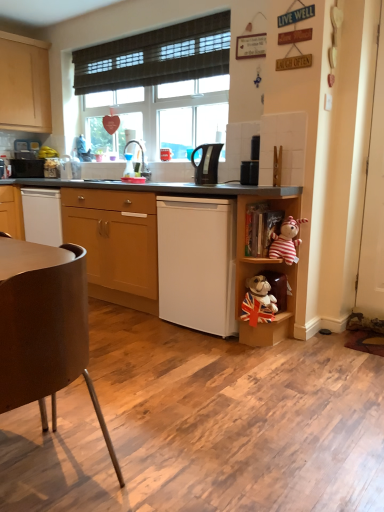
Where is `unoccupied region to the right of wooden shelf at right, the second shelf from the bottom`? This screenshot has width=384, height=512. unoccupied region to the right of wooden shelf at right, the second shelf from the bottom is located at coordinates point(321,343).